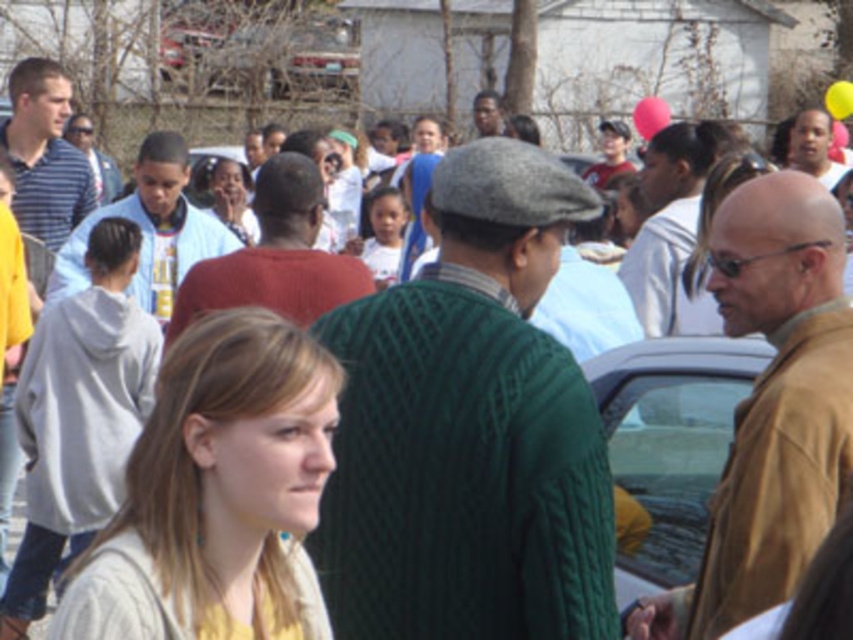
Is green knitted sweater at center wider than striped cotton shirt at left?

Correct, the width of green knitted sweater at center exceeds that of striped cotton shirt at left.

Which is behind, point (473, 515) or point (57, 241)?

The point (57, 241) is more distant.

Does point (525, 524) lie in front of point (51, 76)?

Yes.

Locate an element on the screen. This screenshot has width=853, height=640. green knitted sweater at center is located at coordinates (469, 429).

Is point (282, 236) positioned after point (796, 132)?

That is False.

Can you confirm if red sweater at center is positioned to the left of smooth skin face at upper right?

Correct, you'll find red sweater at center to the left of smooth skin face at upper right.

Is point (303, 280) positioned in front of point (822, 140)?

Yes, point (303, 280) is closer to viewer.

At what (x,y) coordinates should I click in order to perform the action: click on red sweater at center. Please return your answer as a coordinate pair (x, y). Looking at the image, I should click on (276, 257).

Is brown leather jacket at right below matte gray hoodie at left?

Actually, brown leather jacket at right is above matte gray hoodie at left.

Locate an element on the screen. The width and height of the screenshot is (853, 640). brown leather jacket at right is located at coordinates (770, 406).